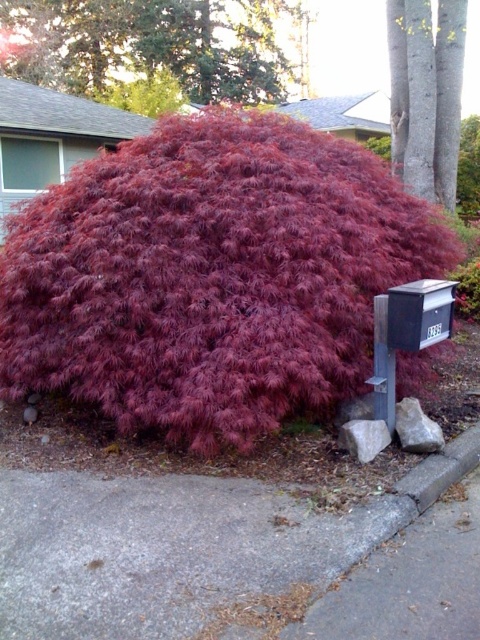
You are a mail carrier trying to deliver a letter to the black matte mailbox at right. You notice the smooth gray bark at upper right is in the way. Can you walk around it to reach the mailbox?

The smooth gray bark at upper right is further to the viewer than the black matte mailbox at right, so the bark is closer to you. You can walk around it to reach the mailbox.

You are standing at the camera position and want to take a photo of the smooth gray bark at upper right. Can you reach it without moving more than 8 meters?

The smooth gray bark at upper right and camera are 7.99 meters apart from each other, so yes, you can reach it without moving more than 8 meters.

From the picture: You are standing at the origin point of the coordinate system. You want to walk towards the purple matte maple at center. What are the coordinates you need to move towards?

The coordinates you need to move towards are 0.434 on the x axis and 0.440 on the y axis.